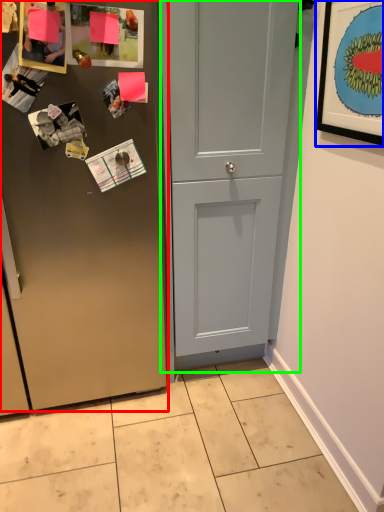
Question: Which is farther away from door (highlighted by a red box)? picture frame (highlighted by a blue box) or door (highlighted by a green box)?

Choices:
 (A) picture frame
 (B) door

Answer: (A)